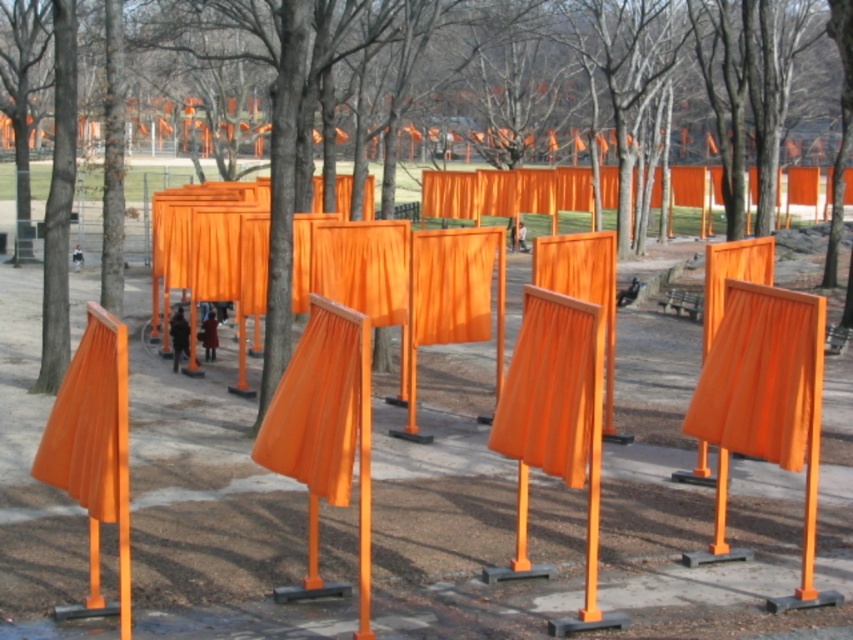
You are an artist planning to install a new sculpture in the park. You have two orange structures available, the orange matte fabric at center and the matte orange curtain at left. Which structure should you choose if you want the one that is shorter?

You should choose the orange matte fabric at center because it is shorter than the matte orange curtain at left.

You are an artist planning to photograph the orange matte curtain at center and the matte orange curtain at center. Which one should you focus on if you want to capture the larger structure in the scene?

The orange matte curtain at center is bigger than the matte orange curtain at center, so you should focus on the orange matte curtain at center to capture the larger structure.

You are an artist planning to install a new sculpture between the orange matte fabric at center and the matte orange curtain at left. The sculpture requires a minimum of 1.5 meters of space. Can the available space accommodate the sculpture?

The distance between the orange matte fabric at center and the matte orange curtain at left is 1.68 meters, which is more than the required 1.5 meters. Therefore, the sculpture can be placed in the available space between them.